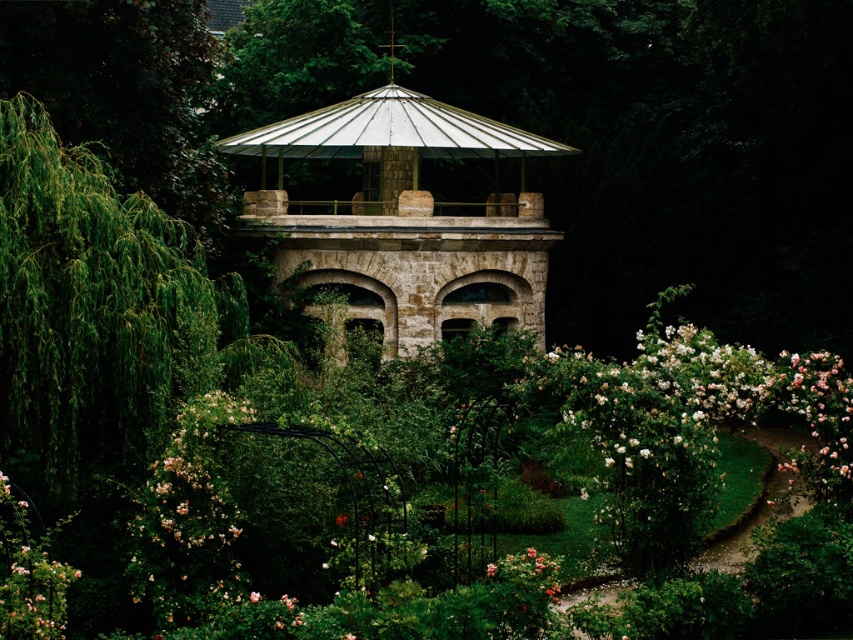
Question: Does stone gazebo at center appear on the right side of pink matte rose at lower center?

Choices:
 (A) no
 (B) yes

Answer: (A)

Question: Which point is closer to the camera taking this photo?

Choices:
 (A) (440, 326)
 (B) (529, 570)

Answer: (B)

Question: In this image, where is stone gazebo at center located relative to pink matte rose at lower center?

Choices:
 (A) left
 (B) right

Answer: (A)

Question: Which point is closer to the camera?

Choices:
 (A) (326, 268)
 (B) (509, 572)

Answer: (B)

Question: Which point is farther to the camera?

Choices:
 (A) (424, 332)
 (B) (490, 577)

Answer: (A)

Question: Can you confirm if stone gazebo at center is bigger than pink matte rose at lower center?

Choices:
 (A) no
 (B) yes

Answer: (B)